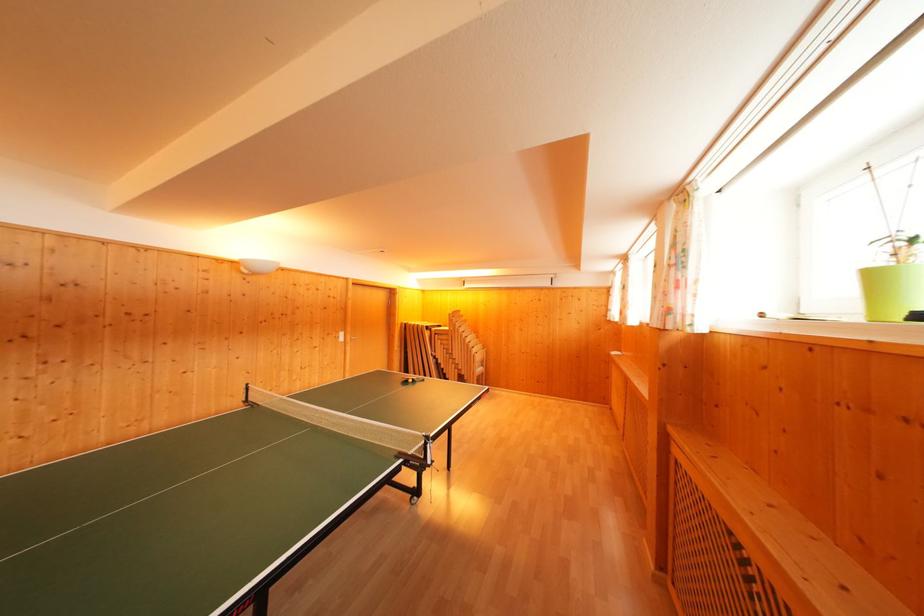
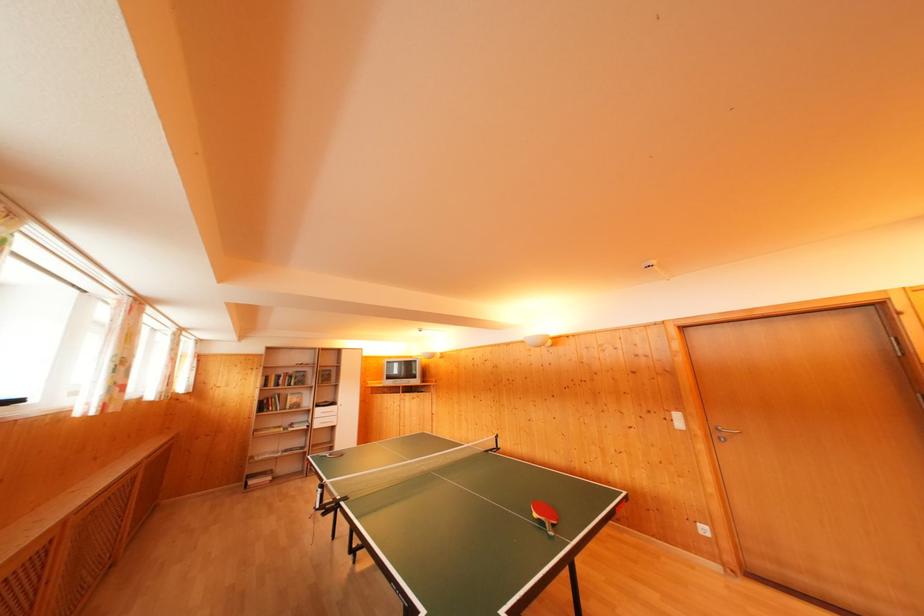
Find the pixel in the second image that matches (x=346, y=339) in the first image.

(682, 421)